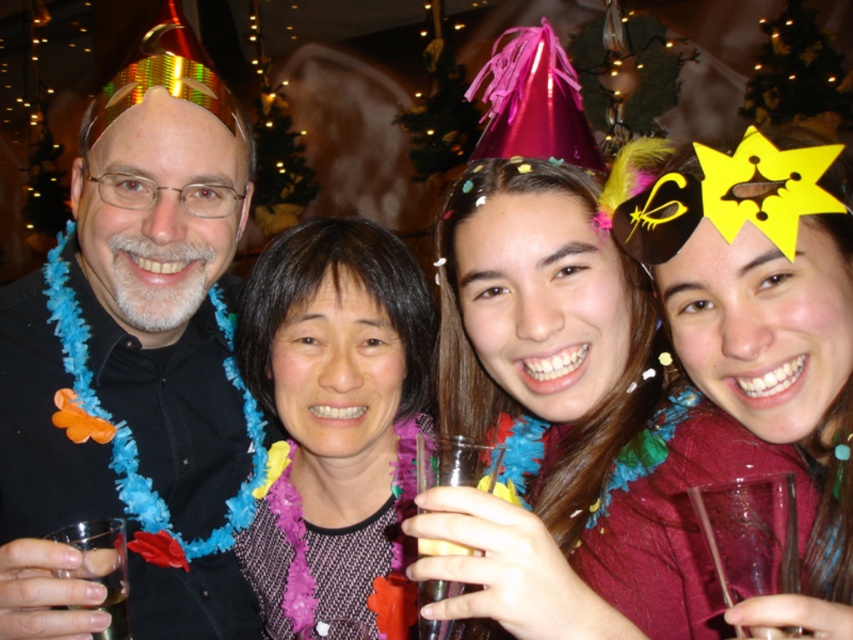
You are a photographer adjusting the camera settings for a group photo. You notice the matte black shirt at left and the shiny maroon dress at center in your frame. Which of these two items should you focus on first to ensure proper exposure, considering their positions?

The matte black shirt at left is taller than the shiny maroon dress at center, so you should focus on the matte black shirt at left first to ensure proper exposure due to its height and potential dominance in the frame.

You are at a holiday party and see the black fabric at center and the translucent plastic cup at lower center. Which object is positioned to the left of the other?

The black fabric at center is to the left of the translucent plastic cup at lower center.